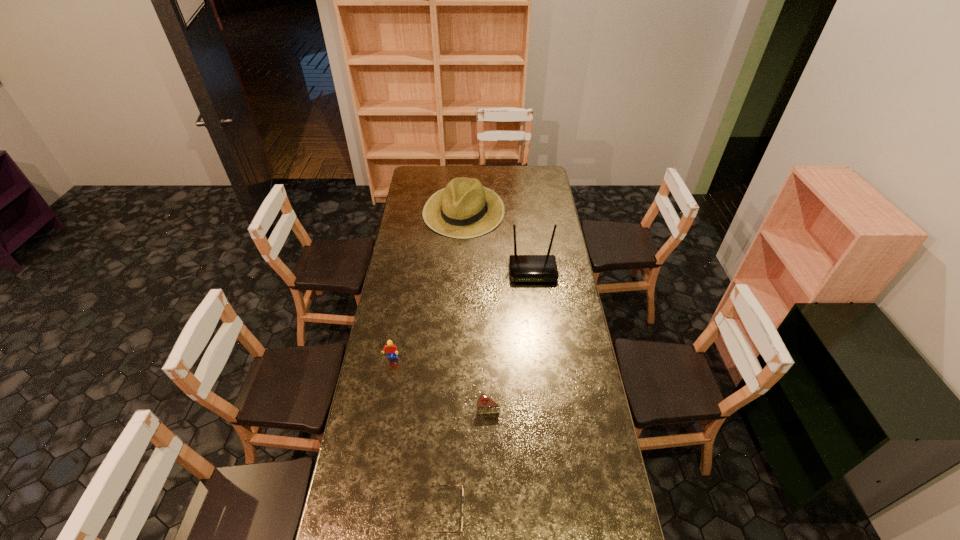
The height and width of the screenshot is (540, 960). I want to click on the tallest object, so click(523, 268).

Where is `the rightmost object`? Image resolution: width=960 pixels, height=540 pixels. the rightmost object is located at coordinates (523, 268).

Identify the location of sunhat. (465, 208).

Where is `the fourth shortest object`? This screenshot has height=540, width=960. the fourth shortest object is located at coordinates click(465, 208).

Find the location of a particular element. the third nearest object is located at coordinates (390, 348).

Locate an element on the screen. The image size is (960, 540). the third tallest object is located at coordinates (390, 348).

Where is `the fourth tallest object`? Image resolution: width=960 pixels, height=540 pixels. the fourth tallest object is located at coordinates click(x=485, y=405).

Identify the location of chocolate cake. (x=485, y=405).

Identify the location of spectacles. (437, 485).

This screenshot has height=540, width=960. I want to click on the shortest object, so click(437, 485).